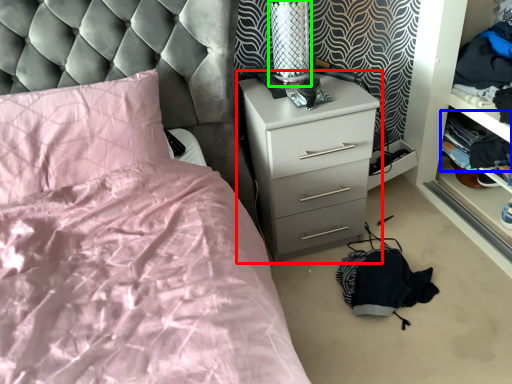
Question: Which object is the closest to the chest of drawers (highlighted by a red box)? Choose among these: clothing (highlighted by a blue box) or table lamp (highlighted by a green box).

Choices:
 (A) clothing
 (B) table lamp

Answer: (B)